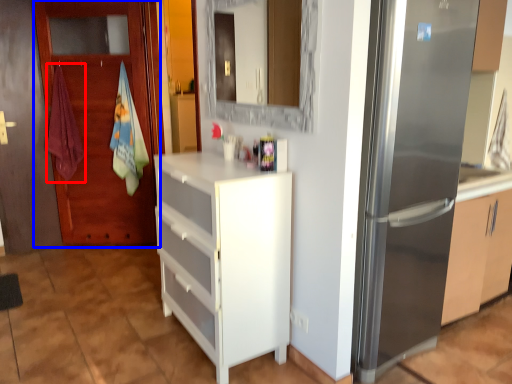
Question: Which point is further to the camera, beach towel (highlighted by a red box) or door (highlighted by a blue box)?

Choices:
 (A) beach towel
 (B) door

Answer: (A)